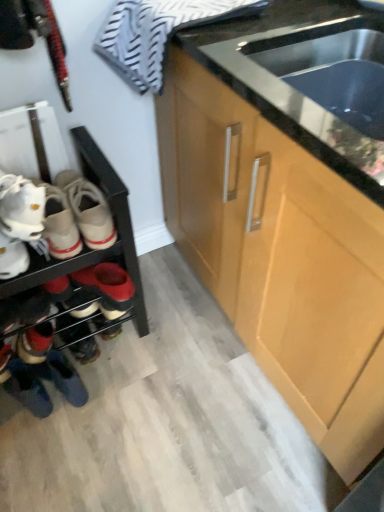
Question: Does stainless steel sink at center turn towards matte wood cabinet at center?

Choices:
 (A) yes
 (B) no

Answer: (A)

Question: Could matte wood cabinet at center be considered to be inside stainless steel sink at center?

Choices:
 (A) yes
 (B) no

Answer: (B)

Question: Is stainless steel sink at center beside matte wood cabinet at center?

Choices:
 (A) no
 (B) yes

Answer: (A)

Question: Is stainless steel sink at center positioned with its back to matte wood cabinet at center?

Choices:
 (A) no
 (B) yes

Answer: (B)

Question: Is stainless steel sink at center not inside matte wood cabinet at center?

Choices:
 (A) yes
 (B) no

Answer: (B)

Question: Is stainless steel sink at center positioned before matte wood cabinet at center?

Choices:
 (A) yes
 (B) no

Answer: (B)

Question: Can you confirm if black matte shoe rack at left is wider than stainless steel sink at center?

Choices:
 (A) yes
 (B) no

Answer: (B)

Question: Does black matte shoe rack at left come in front of stainless steel sink at center?

Choices:
 (A) no
 (B) yes

Answer: (A)

Question: Considering the relative sizes of black matte shoe rack at left and stainless steel sink at center in the image provided, is black matte shoe rack at left thinner than stainless steel sink at center?

Choices:
 (A) yes
 (B) no

Answer: (A)

Question: Considering the relative sizes of black matte shoe rack at left and stainless steel sink at center in the image provided, is black matte shoe rack at left bigger than stainless steel sink at center?

Choices:
 (A) yes
 (B) no

Answer: (A)

Question: Can you confirm if black matte shoe rack at left is positioned to the left of stainless steel sink at center?

Choices:
 (A) no
 (B) yes

Answer: (B)

Question: Is black matte shoe rack at left at the right side of stainless steel sink at center?

Choices:
 (A) yes
 (B) no

Answer: (B)

Question: From the image's perspective, is leather sneakers at lower left, the 1th footwear in the back-to-front sequence, located beneath striped cotton towel at upper left?

Choices:
 (A) no
 (B) yes

Answer: (B)